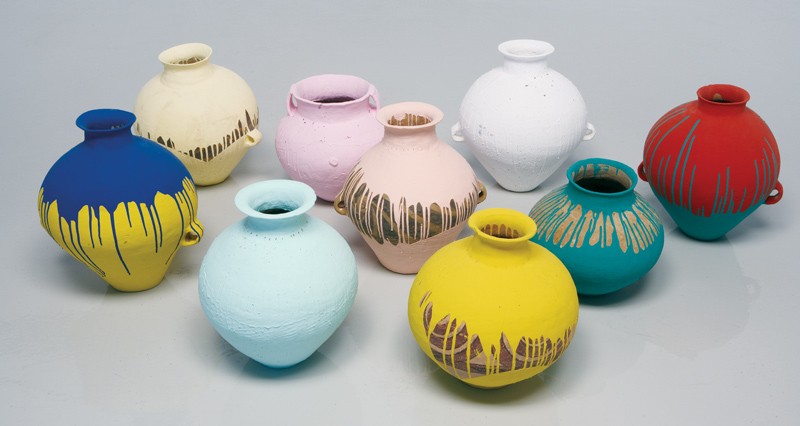
At what (x,y) coordinates should I click in order to perform the action: click on vase. Please return your answer as a coordinate pair (x, y). Looking at the image, I should click on (128, 178).